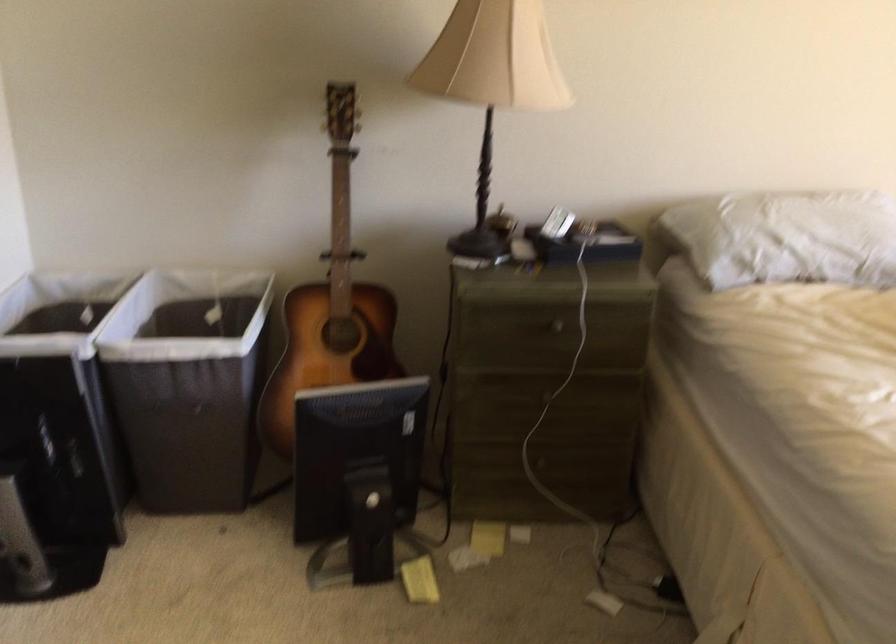
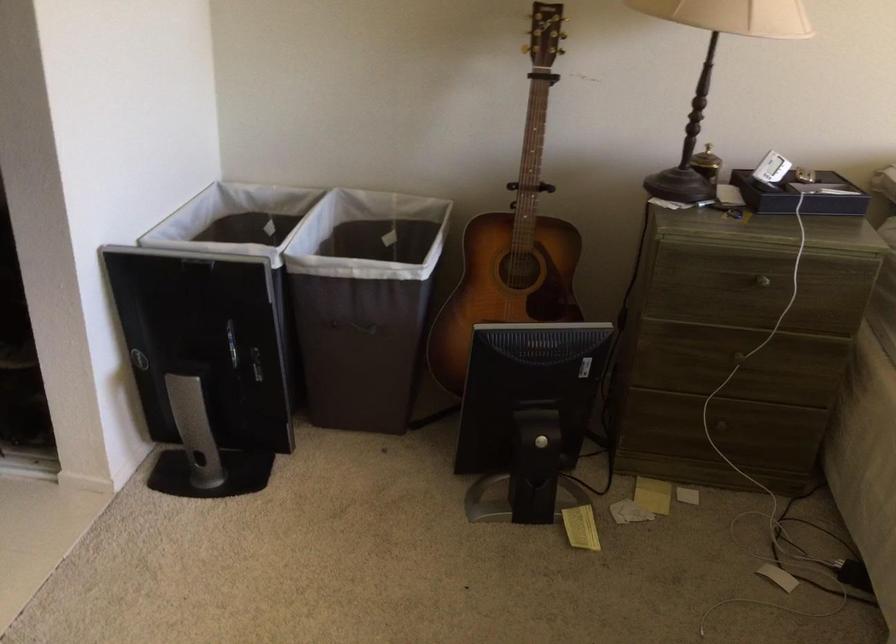
In a continuous first-person perspective shot, in which direction is the camera moving?

The cameraman walked toward left, forward.